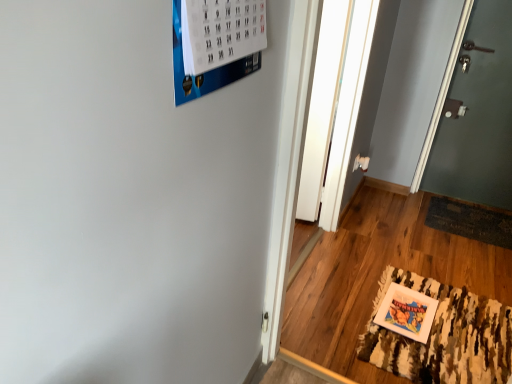
Question: Is white matte picture frame at lower right far from transparent glass door at center?

Choices:
 (A) no
 (B) yes

Answer: (A)

Question: Considering the relative sizes of white matte picture frame at lower right and transparent glass door at center in the image provided, is white matte picture frame at lower right taller than transparent glass door at center?

Choices:
 (A) yes
 (B) no

Answer: (B)

Question: Is the surface of white matte picture frame at lower right in direct contact with transparent glass door at center?

Choices:
 (A) yes
 (B) no

Answer: (B)

Question: From a real-world perspective, is white matte picture frame at lower right beneath transparent glass door at center?

Choices:
 (A) no
 (B) yes

Answer: (B)

Question: Is white matte picture frame at lower right closer to the viewer compared to transparent glass door at center?

Choices:
 (A) no
 (B) yes

Answer: (B)

Question: Considering the positions of white matte picture frame at lower right and transparent glass door at center in the image, is white matte picture frame at lower right taller or shorter than transparent glass door at center?

Choices:
 (A) tall
 (B) short

Answer: (B)

Question: Visually, is white matte picture frame at lower right positioned to the left or to the right of transparent glass door at center?

Choices:
 (A) right
 (B) left

Answer: (A)

Question: Is point click(x=392, y=307) positioned closer to the camera than point click(x=305, y=210)?

Choices:
 (A) farther
 (B) closer

Answer: (B)

Question: Which is correct: white matte picture frame at lower right is inside transparent glass door at center, or outside of it?

Choices:
 (A) inside
 (B) outside

Answer: (B)

Question: Considering the positions of transparent glass door at center and camouflage-patterned rug at lower right in the image, is transparent glass door at center taller or shorter than camouflage-patterned rug at lower right?

Choices:
 (A) tall
 (B) short

Answer: (A)

Question: Is transparent glass door at center wider or thinner than camouflage-patterned rug at lower right?

Choices:
 (A) thin
 (B) wide

Answer: (A)

Question: Looking at the image, does transparent glass door at center seem bigger or smaller compared to camouflage-patterned rug at lower right?

Choices:
 (A) big
 (B) small

Answer: (B)

Question: From the image's perspective, relative to camouflage-patterned rug at lower right, is transparent glass door at center above or below?

Choices:
 (A) below
 (B) above

Answer: (B)

Question: From a real-world perspective, is white matte picture frame at lower right above or below camouflage-patterned rug at lower right?

Choices:
 (A) above
 (B) below

Answer: (B)

Question: Considering the positions of point (401, 322) and point (467, 347), is point (401, 322) closer or farther from the camera than point (467, 347)?

Choices:
 (A) farther
 (B) closer

Answer: (A)